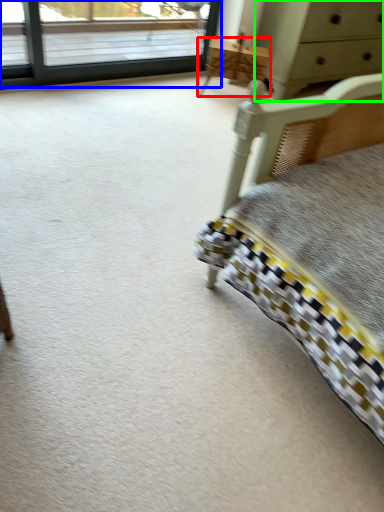
Question: Considering the real-world distances, which object is closest to furniture (highlighted by a red box)? window (highlighted by a blue box) or chest of drawers (highlighted by a green box).

Choices:
 (A) window
 (B) chest of drawers

Answer: (B)